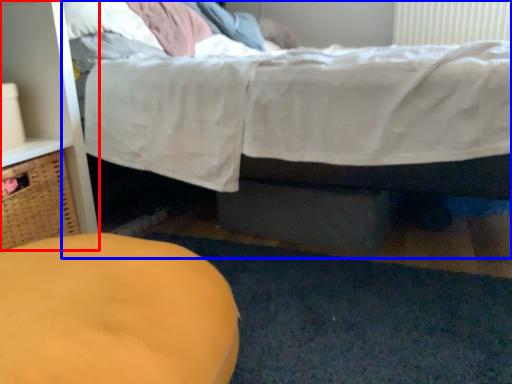
Question: Which object is closer to the camera taking this photo, dresser (highlighted by a red box) or bed (highlighted by a blue box)?

Choices:
 (A) dresser
 (B) bed

Answer: (B)